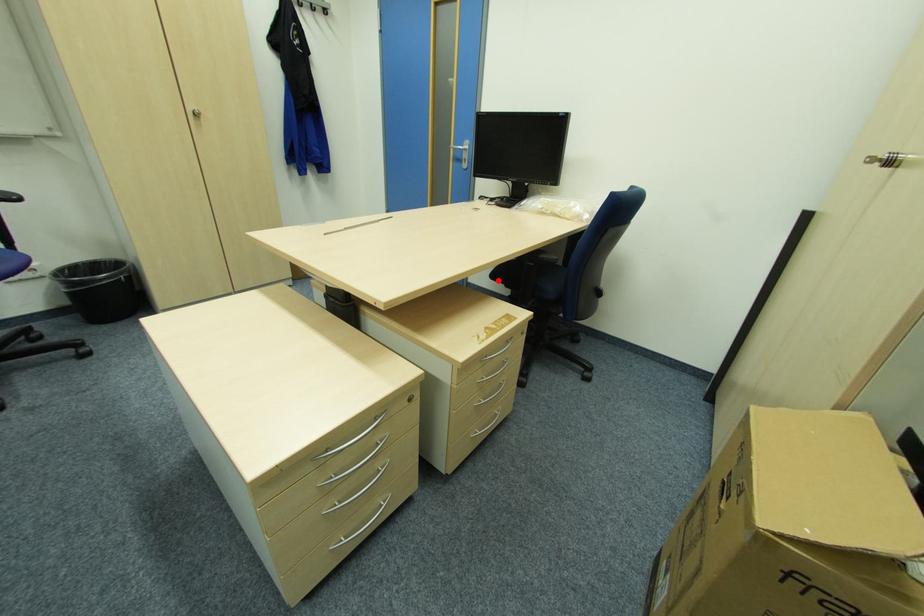
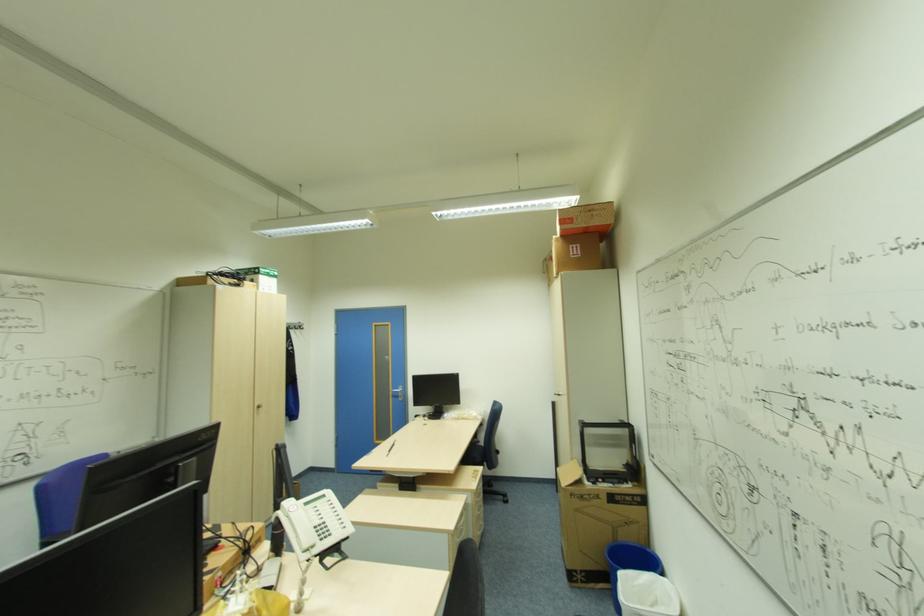
Question: I am providing you with two images of the same scene from different viewpoints. A red point is marked on the first image. Is the red point's position out of view in image 2?

Choices:
 (A) Yes
 (B) No

Answer: (A)